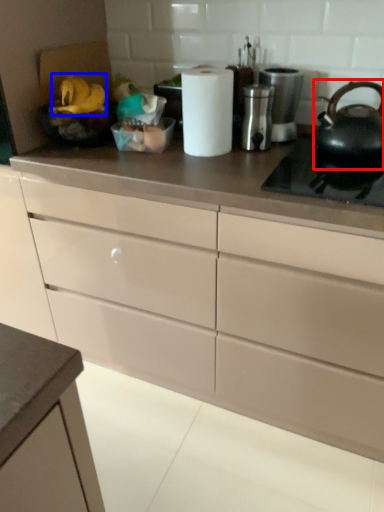
Question: Among these objects, which one is farthest to the camera, tea pot (highlighted by a red box) or food (highlighted by a blue box)?

Choices:
 (A) tea pot
 (B) food

Answer: (B)